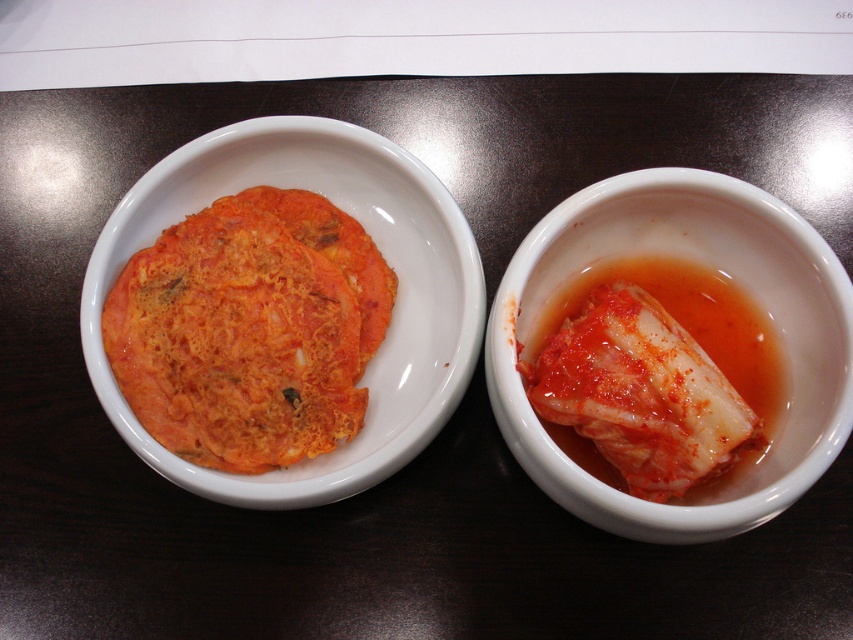
Between point (318, 372) and point (519, 268), which one is positioned in front?

Positioned in front is point (519, 268).

Does orange matte kimchi at left have a greater height compared to matte white bowl at center?

In fact, orange matte kimchi at left may be shorter than matte white bowl at center.

The height and width of the screenshot is (640, 853). I want to click on orange matte kimchi at left, so click(x=250, y=330).

Find the location of a particular element. orange matte kimchi at left is located at coordinates (250, 330).

Does matte white bowl at center come in front of white glossy kimchi at right?

Yes, it is.

Does point (556, 464) lie in front of point (599, 401)?

Yes, point (556, 464) is closer to viewer.

The image size is (853, 640). What do you see at coordinates (720, 275) in the screenshot?
I see `matte white bowl at center` at bounding box center [720, 275].

Where is `matte white bowl at center`? matte white bowl at center is located at coordinates (720, 275).

Is orange matte kimchi at left in front of white glossy kimchi at right?

No, orange matte kimchi at left is further to the viewer.

Who is positioned more to the right, orange matte kimchi at left or white glossy kimchi at right?

white glossy kimchi at right

Between point (364, 333) and point (646, 436), which one is positioned in front?

Point (646, 436)

Where is `orange matte kimchi at left`? Image resolution: width=853 pixels, height=640 pixels. orange matte kimchi at left is located at coordinates (250, 330).